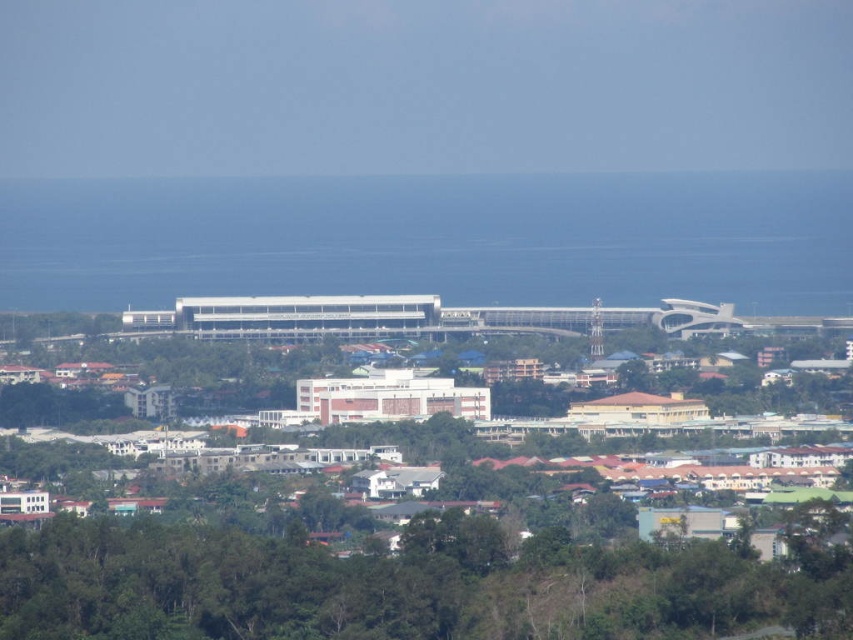
You are standing at the center of the image. There is a transparent glass water at center in front of you. Where exactly is it located in terms of coordinates?

The transparent glass water at center is located at point coordinates of (433,240).